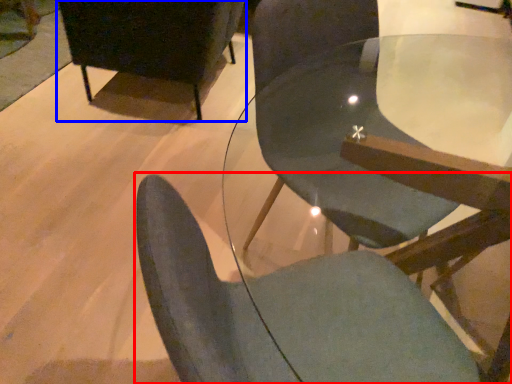
Question: Which point is further to the camera, chair (highlighted by a red box) or chair (highlighted by a blue box)?

Choices:
 (A) chair
 (B) chair

Answer: (B)